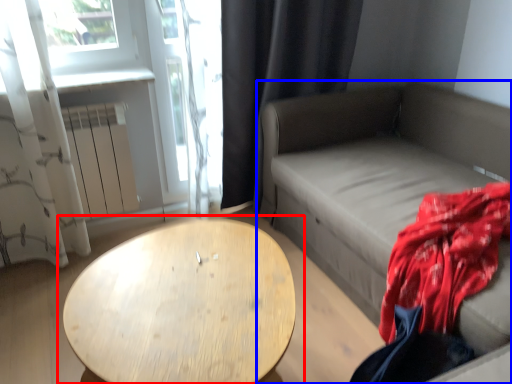
Question: Among these objects, which one is farthest to the camera, table (highlighted by a red box) or studio couch (highlighted by a blue box)?

Choices:
 (A) table
 (B) studio couch

Answer: (B)